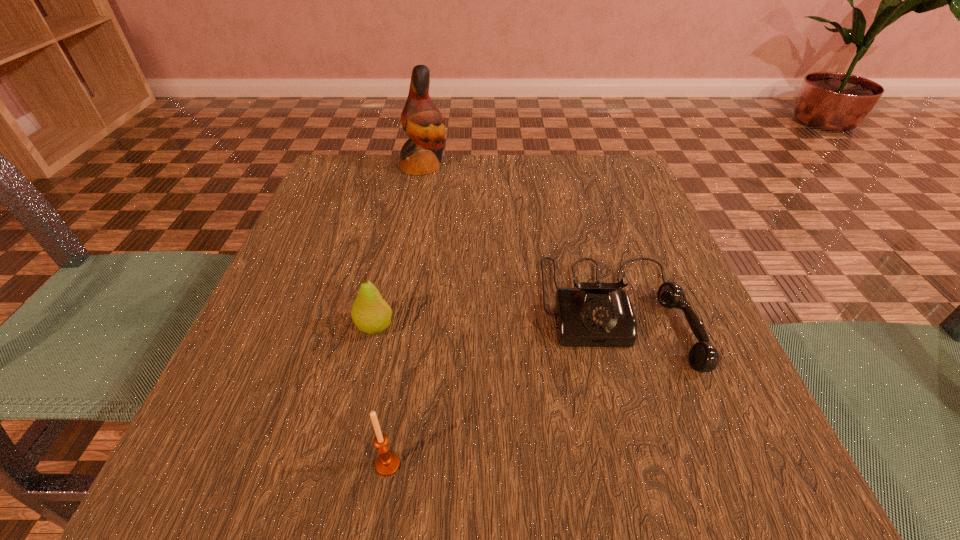
Identify the location of free space between the candle_holder and the rightmost object. The width and height of the screenshot is (960, 540). (502, 388).

Locate an element on the screen. This screenshot has width=960, height=540. blank region between the nearest object and the pear is located at coordinates (381, 395).

You are a GUI agent. You are given a task and a screenshot of the screen. Output one action in this format:
    pyautogui.click(x=<x>, y=<y>)
    Task: Click on the vacant area that lies between the telephone and the farthest object
    
    Given the screenshot: What is the action you would take?
    pyautogui.click(x=520, y=239)

The image size is (960, 540). In order to click on free space between the tallest object and the pear in this screenshot , I will do `click(399, 247)`.

This screenshot has width=960, height=540. Identify the location of vacant space that's between the candle_holder and the pear. (381, 395).

Locate an element on the screen. vacant area between the nearest object and the parrot is located at coordinates (406, 315).

The image size is (960, 540). Identify the location of empty space between the tallest object and the candle_holder. (406, 315).

This screenshot has height=540, width=960. Find the location of `vacant region between the tallest object and the nearest object`. vacant region between the tallest object and the nearest object is located at coordinates (406, 315).

The image size is (960, 540). What are the coordinates of `empty location between the rightmost object and the farthest object` in the screenshot? It's located at (520, 239).

This screenshot has height=540, width=960. In order to click on free space that is in between the nearest object and the rightmost object in this screenshot , I will do `click(502, 388)`.